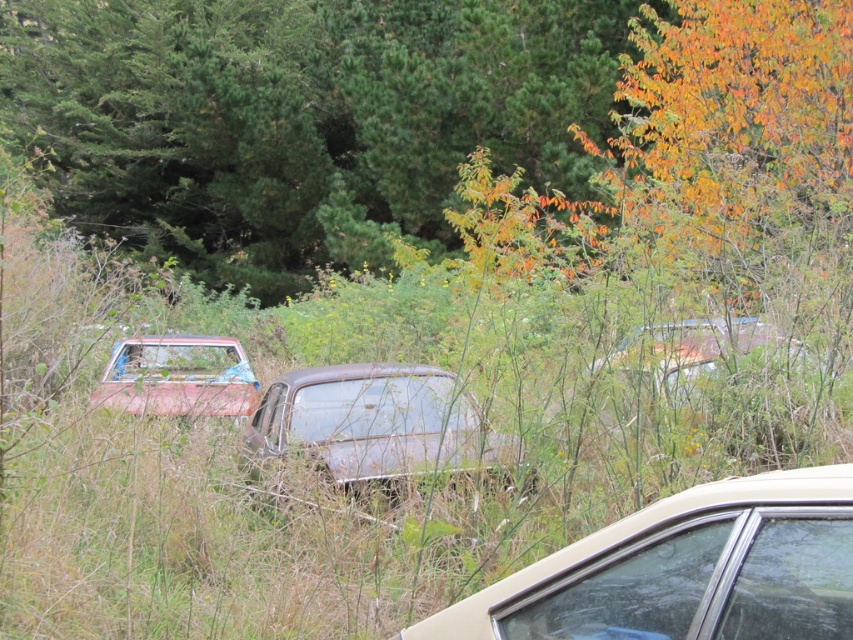
You are standing in the abandoned car lot and need to reach the metallic beige sedan at lower right. If your maximum reach is 6 feet, can you touch it without moving closer?

The metallic beige sedan at lower right is 7.09 feet away from the viewer, which is beyond your 6 feet reach, so you cannot touch it without moving closer.

You are a photographer planning to capture a wide shot of the scene. Considering the green matte tree at upper center and the rusty metal car at left, which object would require a wider framing to fully capture its width in the photo?

The green matte tree at upper center would require a wider framing because its width surpasses that of the rusty metal car at left.